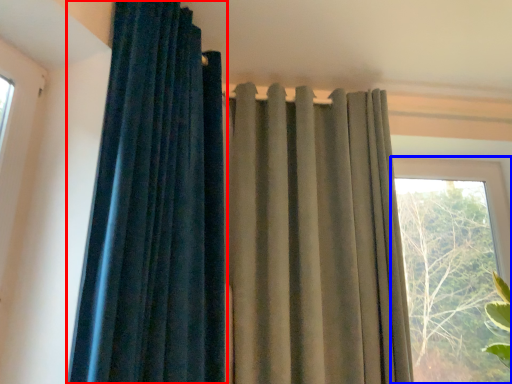
Question: Which object is closer to the camera taking this photo, curtain (highlighted by a red box) or window (highlighted by a blue box)?

Choices:
 (A) curtain
 (B) window

Answer: (A)